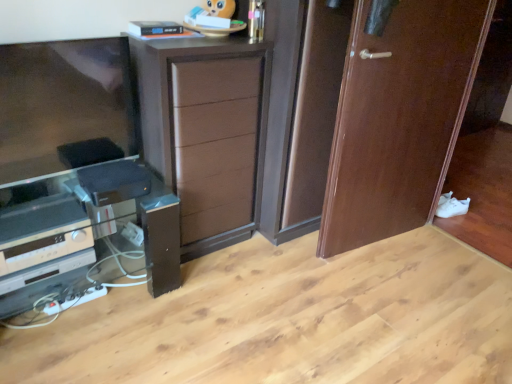
The height and width of the screenshot is (384, 512). Identify the location of free space between brown wood chest of drawers at center and black glossy speaker at lower left. (211, 271).